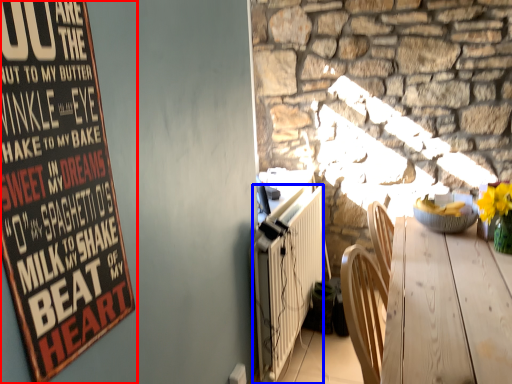
Question: Which of the following is the closest to the observer, poster (highlighted by a red box) or radiator (highlighted by a blue box)?

Choices:
 (A) poster
 (B) radiator

Answer: (A)